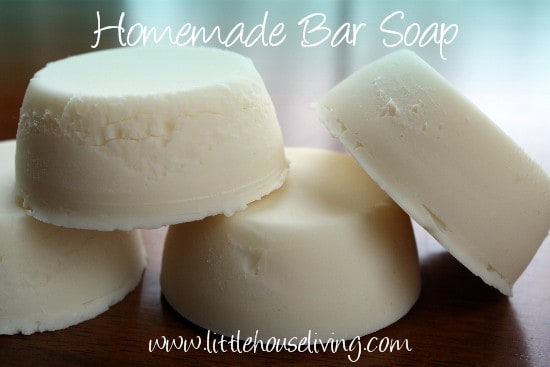
Where is `table`? table is located at coordinates (152, 315).